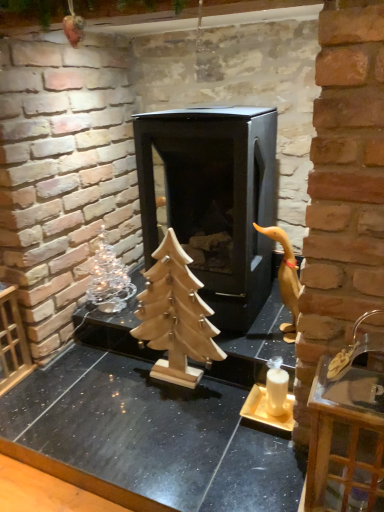
You are a GUI agent. You are given a task and a screenshot of the screen. Output one action in this format:
    pyautogui.click(x=<x>, y=<y>)
    Task: Click on the free space to the left of white matte candle holder at lower right
    The width and height of the screenshot is (384, 512).
    Given the screenshot: What is the action you would take?
    pyautogui.click(x=216, y=422)